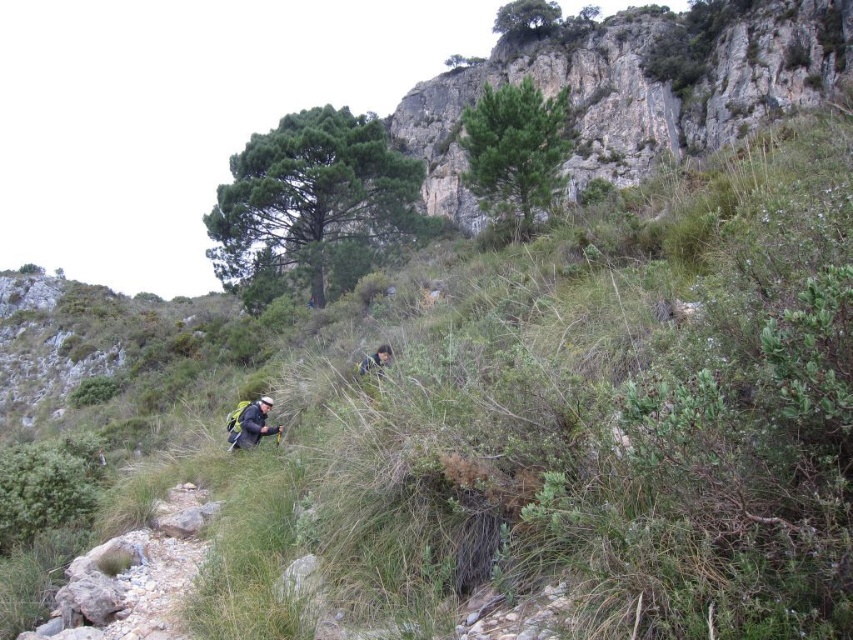
Between dark gray jacket at lower left and camouflage fabric person at lower center, which one has less height?

With less height is camouflage fabric person at lower center.

Does dark gray jacket at lower left have a greater width compared to camouflage fabric person at lower center?

Yes, dark gray jacket at lower left is wider than camouflage fabric person at lower center.

Where is `dark gray jacket at lower left`? The image size is (853, 640). dark gray jacket at lower left is located at coordinates (250, 422).

Based on the photo, does rough textured rock at upper center appear on the left side of dark gray jacket at lower left?

No, rough textured rock at upper center is not to the left of dark gray jacket at lower left.

Is rough textured rock at upper center positioned before dark gray jacket at lower left?

That is False.

Is point (595, 156) behind point (254, 419)?

That is True.

Locate an element on the screen. The width and height of the screenshot is (853, 640). rough textured rock at upper center is located at coordinates (634, 92).

Can you confirm if rough textured rock at upper center is positioned to the right of camouflage fabric person at lower center?

Yes, rough textured rock at upper center is to the right of camouflage fabric person at lower center.

Is rough textured rock at upper center further to the viewer compared to camouflage fabric person at lower center?

Yes, it is behind camouflage fabric person at lower center.

Is point (699, 122) less distant than point (373, 362)?

No, it is not.

The image size is (853, 640). I want to click on rough textured rock at upper center, so click(x=634, y=92).